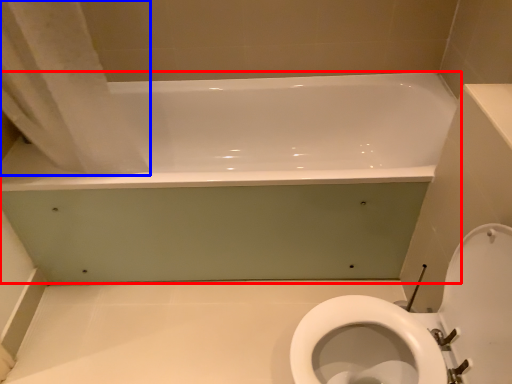
Question: Among these objects, which one is farthest to the camera, bathtub (highlighted by a red box) or shower curtain (highlighted by a blue box)?

Choices:
 (A) bathtub
 (B) shower curtain

Answer: (A)